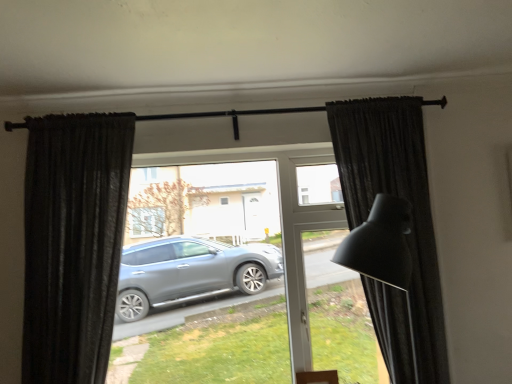
Question: Is black textured curtain at left, marked as the 2th curtain in a right-to-left arrangement, spatially inside dark matte curtain at right, the second curtain in the left-to-right sequence, or outside of it?

Choices:
 (A) inside
 (B) outside

Answer: (B)

Question: Relative to dark matte curtain at right, the second curtain in the left-to-right sequence, is black textured curtain at left, marked as the 2th curtain in a right-to-left arrangement, in front or behind?

Choices:
 (A) front
 (B) behind

Answer: (B)

Question: Would you say black textured curtain at left, marked as the 2th curtain in a right-to-left arrangement, is to the left or to the right of dark matte curtain at right, the second curtain in the left-to-right sequence, in the picture?

Choices:
 (A) left
 (B) right

Answer: (A)

Question: Is dark matte curtain at right, which is counted as the 1th curtain, starting from the right, in front of or behind black textured curtain at left, marked as the 2th curtain in a right-to-left arrangement, in the image?

Choices:
 (A) front
 (B) behind

Answer: (A)

Question: Is dark matte curtain at right, the second curtain in the left-to-right sequence, inside the boundaries of black textured curtain at left, which ranks as the first curtain in left-to-right order, or outside?

Choices:
 (A) outside
 (B) inside

Answer: (A)

Question: Looking at the image, does dark matte curtain at right, the second curtain in the left-to-right sequence, seem bigger or smaller compared to black textured curtain at left, which ranks as the first curtain in left-to-right order?

Choices:
 (A) big
 (B) small

Answer: (A)

Question: Considering the positions of dark matte curtain at right, the second curtain in the left-to-right sequence, and black textured curtain at left, marked as the 2th curtain in a right-to-left arrangement, in the image, is dark matte curtain at right, the second curtain in the left-to-right sequence, taller or shorter than black textured curtain at left, marked as the 2th curtain in a right-to-left arrangement,?

Choices:
 (A) short
 (B) tall

Answer: (B)